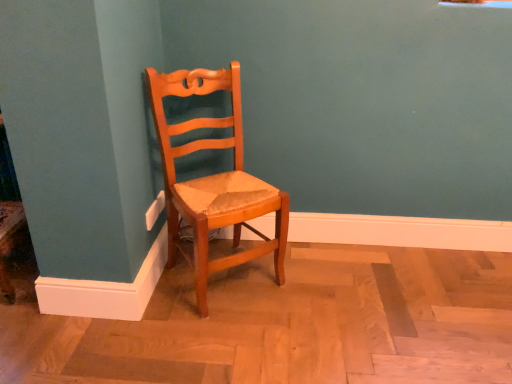
The image size is (512, 384). Find the location of `vacant point to the right of wooden chair at center`. vacant point to the right of wooden chair at center is located at coordinates (314, 283).